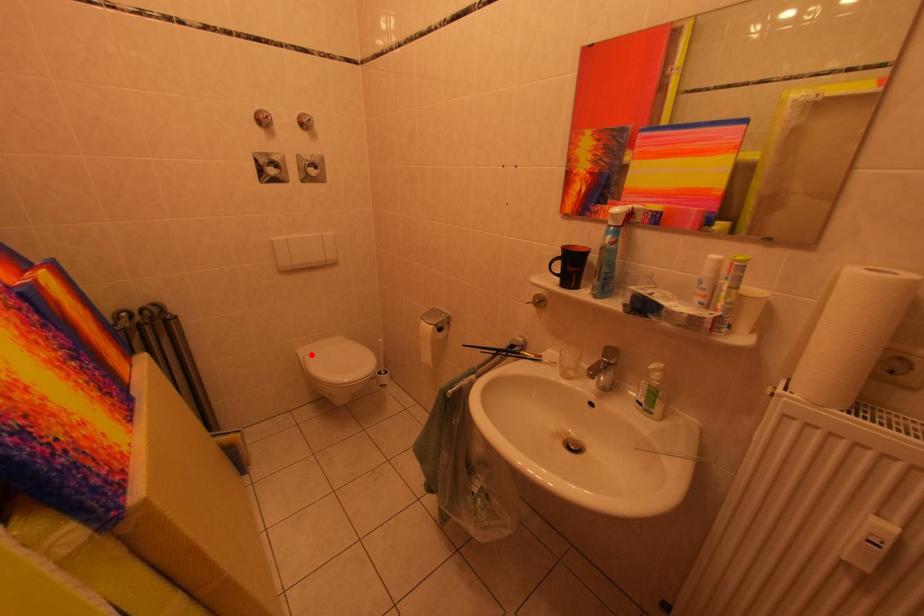
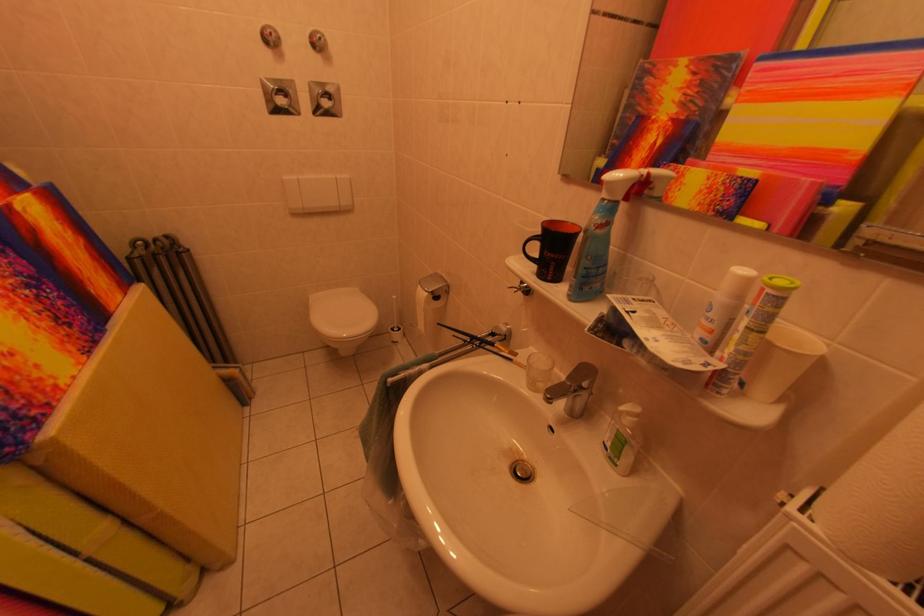
Question: I am providing you with two images of the same scene from different viewpoints. In image1, a red point is highlighted. Considering the same 3D point in image2, which of the following is correct?

Choices:
 (A) It is closer
 (B) It is farther

Answer: (B)